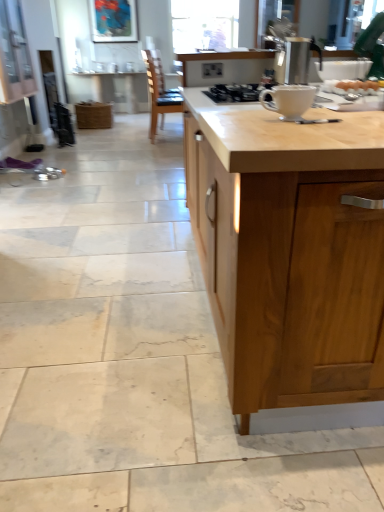
Question: From the image's perspective, is white glossy mug at center located above or below matte white table at center?

Choices:
 (A) above
 (B) below

Answer: (B)

Question: Is white glossy mug at center in front of or behind matte white table at center in the image?

Choices:
 (A) behind
 (B) front

Answer: (B)

Question: Which is farther from the matte white table at center?

Choices:
 (A) metallic silver kettle at upper right
 (B) transparent glass window at upper center
 (C) matte wood cabinet at upper left
 (D) white glossy mug at center
 (E) light wood countertop at center

Answer: (E)

Question: Which of these objects is positioned closest to the metallic silver kettle at upper right?

Choices:
 (A) white glossy gas stove at center
 (B) white glossy mug at center
 (C) matte wood cabinet at upper left
 (D) wooden chair at center
 (E) light wood countertop at center

Answer: (A)